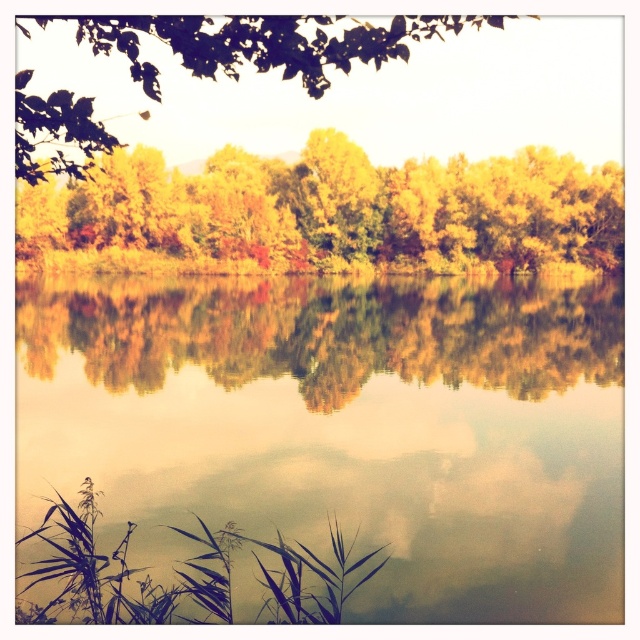
In the scene shown: Based on the scene description, where is the smooth reflective water at center located in the image?

The smooth reflective water at center is located at the 2D coordinates point of (x=346, y=428).